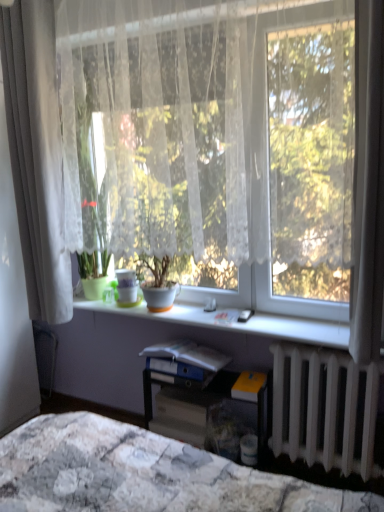
Identify the location of free space in front of black plastic remote control at center. Image resolution: width=384 pixels, height=512 pixels. 256,326.